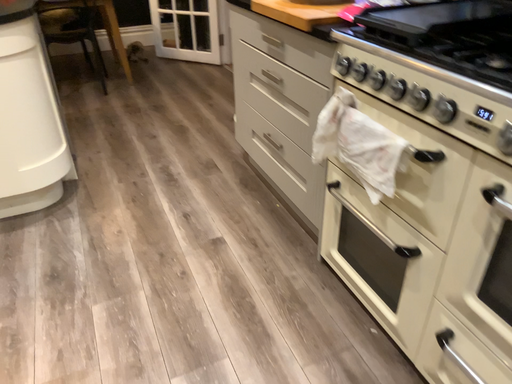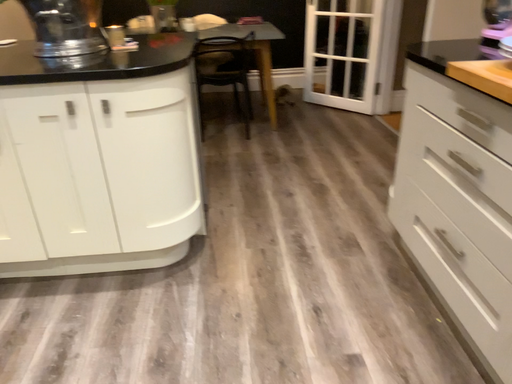
Question: How did the camera likely rotate when shooting the video?

Choices:
 (A) rotated right
 (B) rotated left

Answer: (B)